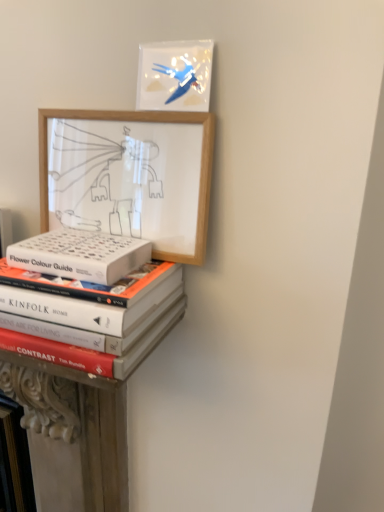
Question: Is wooden picture frame at upper left, the 1th picture frame in the bottom-to-top sequence, surrounded by white matte book at center?

Choices:
 (A) no
 (B) yes

Answer: (A)

Question: Can you confirm if white matte book at center is smaller than wooden picture frame at upper left, the 2th picture frame when ordered from top to bottom?

Choices:
 (A) no
 (B) yes

Answer: (B)

Question: Is white matte book at center at the right side of wooden picture frame at upper left, the 2th picture frame when ordered from top to bottom?

Choices:
 (A) no
 (B) yes

Answer: (A)

Question: Considering the relative sizes of white matte book at center and wooden picture frame at upper left, the 2th picture frame when ordered from top to bottom, in the image provided, is white matte book at center bigger than wooden picture frame at upper left, the 2th picture frame when ordered from top to bottom,?

Choices:
 (A) yes
 (B) no

Answer: (B)

Question: From the image's perspective, is white matte book at center located above wooden picture frame at upper left, the 2th picture frame when ordered from top to bottom?

Choices:
 (A) yes
 (B) no

Answer: (B)

Question: Is the surface of white matte book at center in direct contact with wooden picture frame at upper left, the 2th picture frame when ordered from top to bottom?

Choices:
 (A) yes
 (B) no

Answer: (B)

Question: Could you tell me if hardcover books at lower left is turned towards white matte book at center?

Choices:
 (A) yes
 (B) no

Answer: (B)

Question: Considering the relative sizes of hardcover books at lower left and white matte book at center in the image provided, is hardcover books at lower left smaller than white matte book at center?

Choices:
 (A) yes
 (B) no

Answer: (B)

Question: Is hardcover books at lower left taller than white matte book at center?

Choices:
 (A) yes
 (B) no

Answer: (A)

Question: Considering the relative positions of hardcover books at lower left and white matte book at center in the image provided, is hardcover books at lower left to the right of white matte book at center from the viewer's perspective?

Choices:
 (A) no
 (B) yes

Answer: (A)

Question: Is hardcover books at lower left turned away from white matte book at center?

Choices:
 (A) yes
 (B) no

Answer: (B)

Question: Is hardcover books at lower left far from white matte book at center?

Choices:
 (A) yes
 (B) no

Answer: (B)

Question: Is there a large distance between white matte book at center and hardcover books at lower left?

Choices:
 (A) yes
 (B) no

Answer: (B)